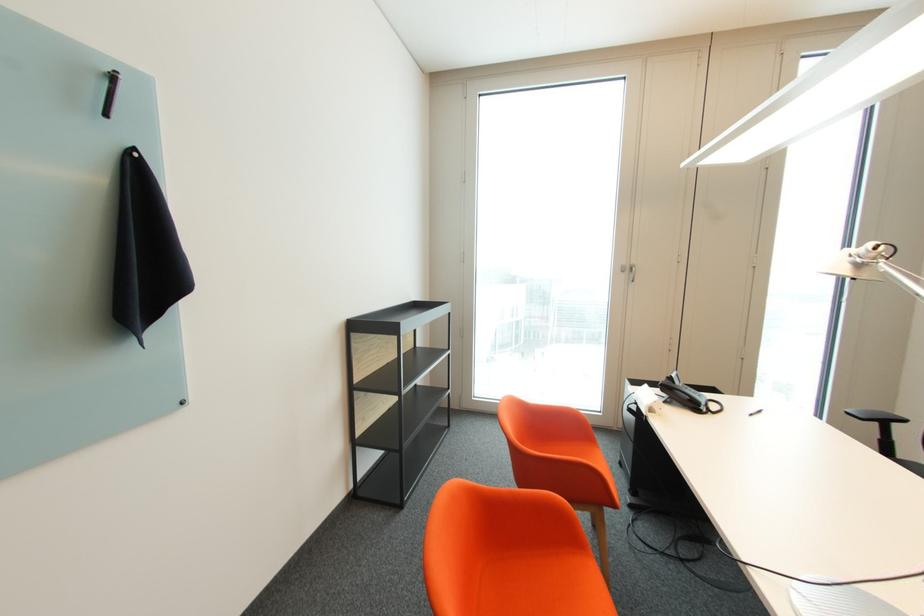
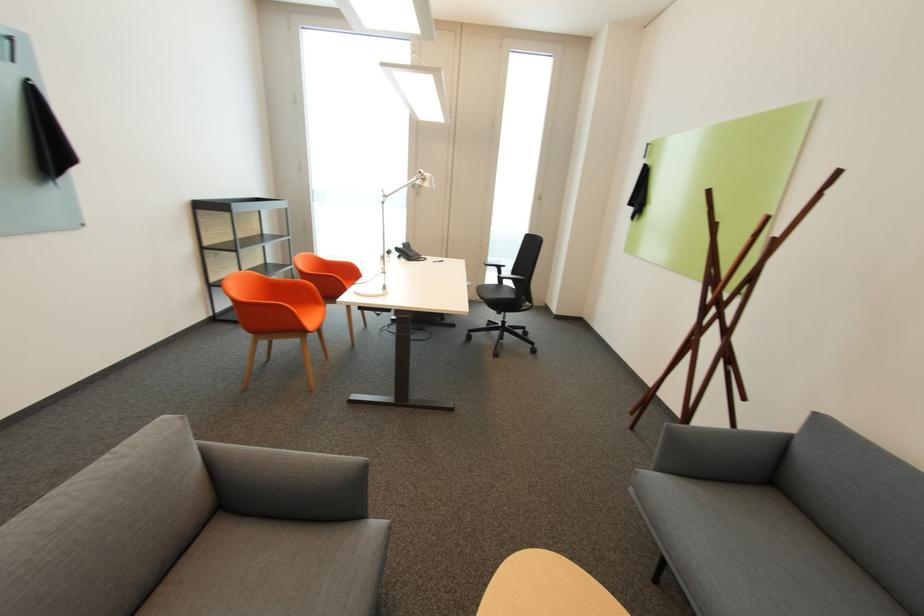
Question: I am providing you with two images of the same scene from different viewpoints. Which of the following objects are not visible in image2?

Choices:
 (A) wooden coat rack stick
 (B) white lamp head
 (C) grey sofa armrest
 (D) none of these

Answer: (D)